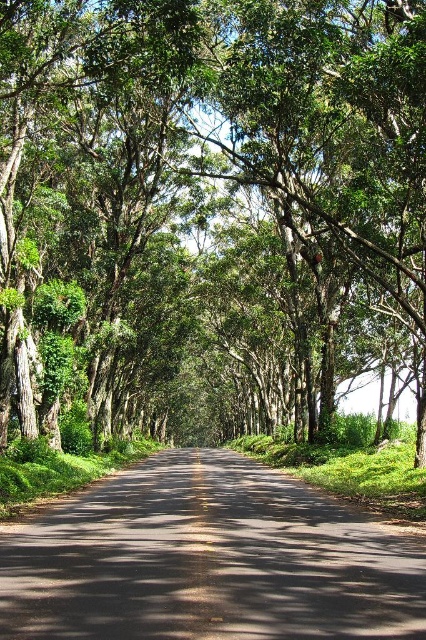
Who is positioned more to the right, green leafy tree at center or black asphalt road at center?

Positioned to the right is green leafy tree at center.

Does green leafy tree at center lie behind black asphalt road at center?

Yes, it is behind black asphalt road at center.

Identify the location of green leafy tree at center. This screenshot has height=640, width=426. (207, 211).

Where is `green leafy tree at center`? green leafy tree at center is located at coordinates (207, 211).